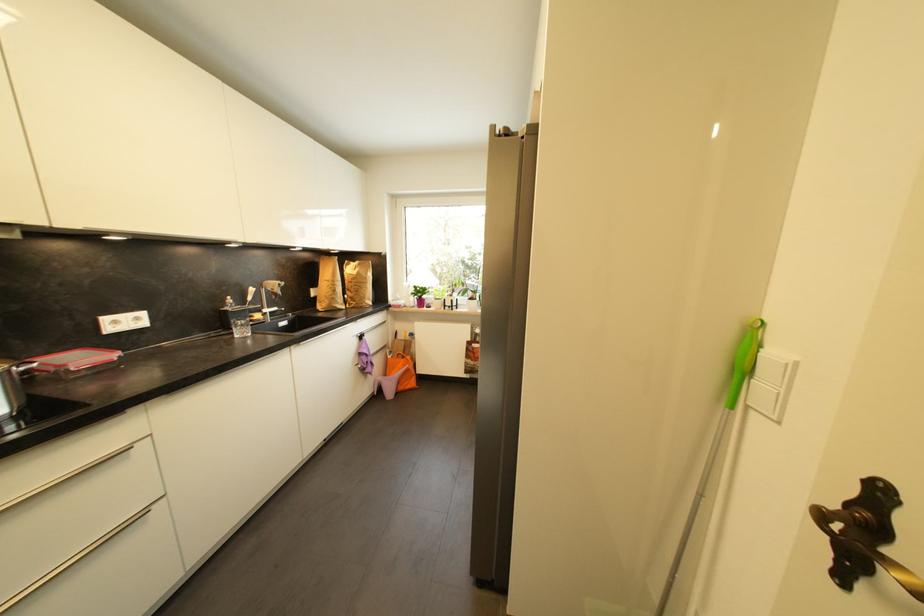
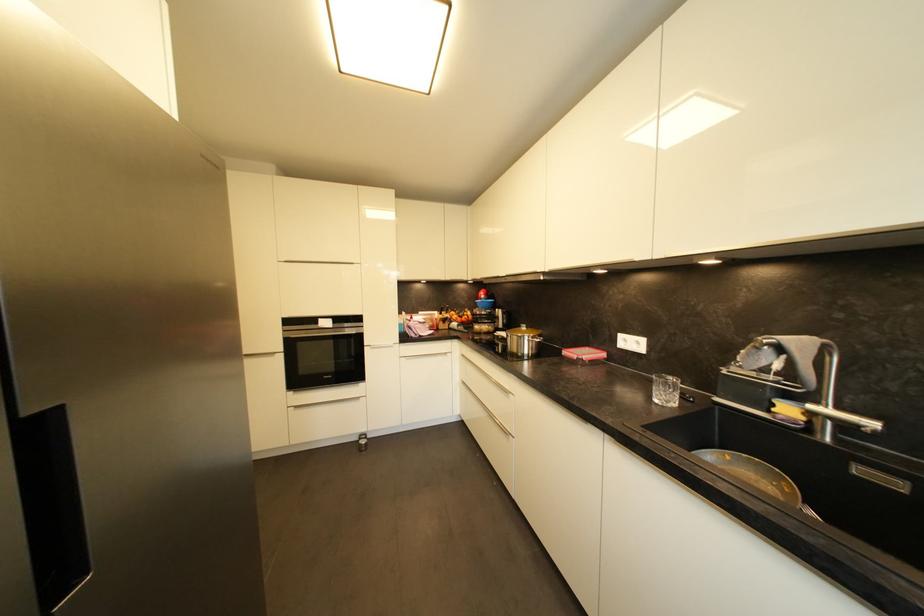
The point at (262, 318) is marked in the first image. Where is the corresponding point in the second image?

(793, 411)